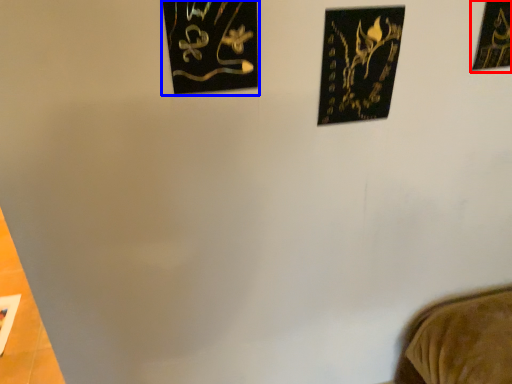
Question: Which of the following is the closest to the observer, picture frame (highlighted by a red box) or picture frame (highlighted by a blue box)?

Choices:
 (A) picture frame
 (B) picture frame

Answer: (B)